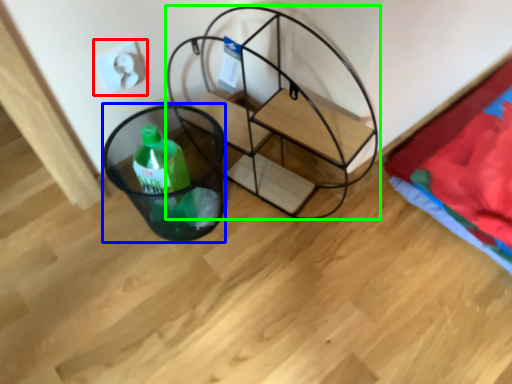
Question: Considering the real-world distances, which object is farthest from electric outlet (highlighted by a red box)? basket (highlighted by a blue box) or furniture (highlighted by a green box)?

Choices:
 (A) basket
 (B) furniture

Answer: (B)